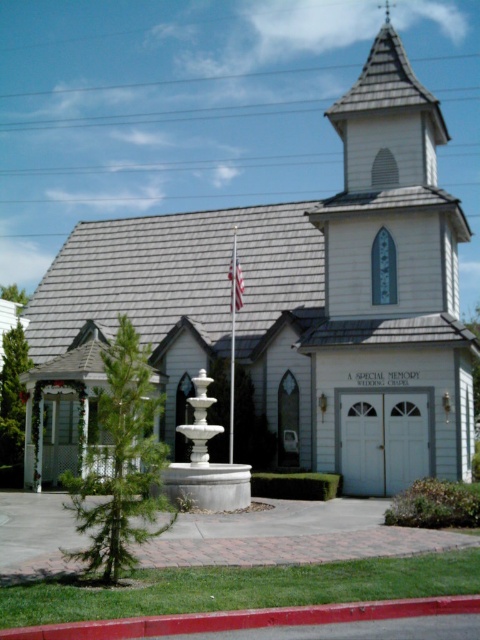
Question: Is white glossy flag pole at center to the right of white fabric flag at upper center from the viewer's perspective?

Choices:
 (A) yes
 (B) no

Answer: (B)

Question: Does white glossy flag pole at center come behind white fabric flag at upper center?

Choices:
 (A) yes
 (B) no

Answer: (B)

Question: Is white glossy flag pole at center above white fabric flag at upper center?

Choices:
 (A) yes
 (B) no

Answer: (B)

Question: Which point appears closest to the camera in this image?

Choices:
 (A) (229, 268)
 (B) (233, 323)

Answer: (B)